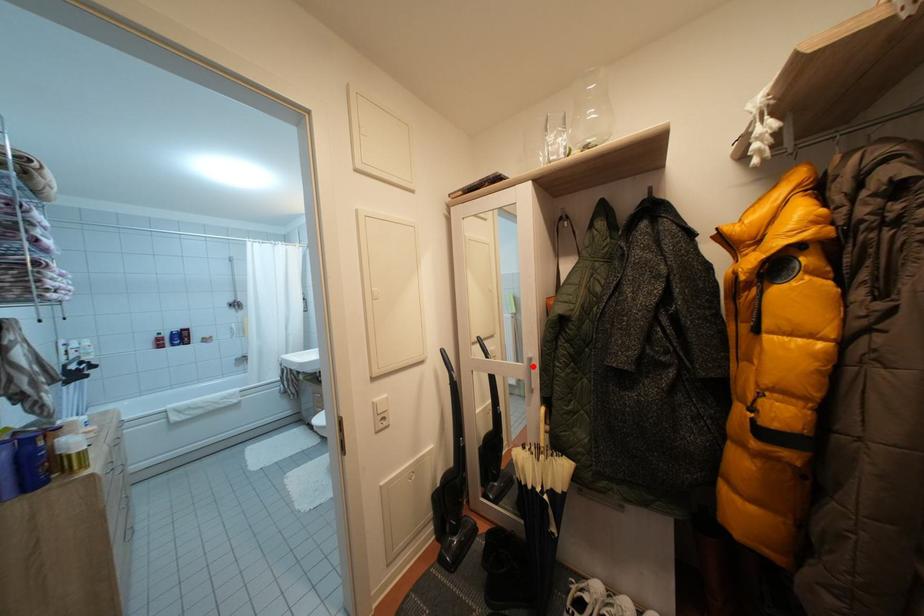
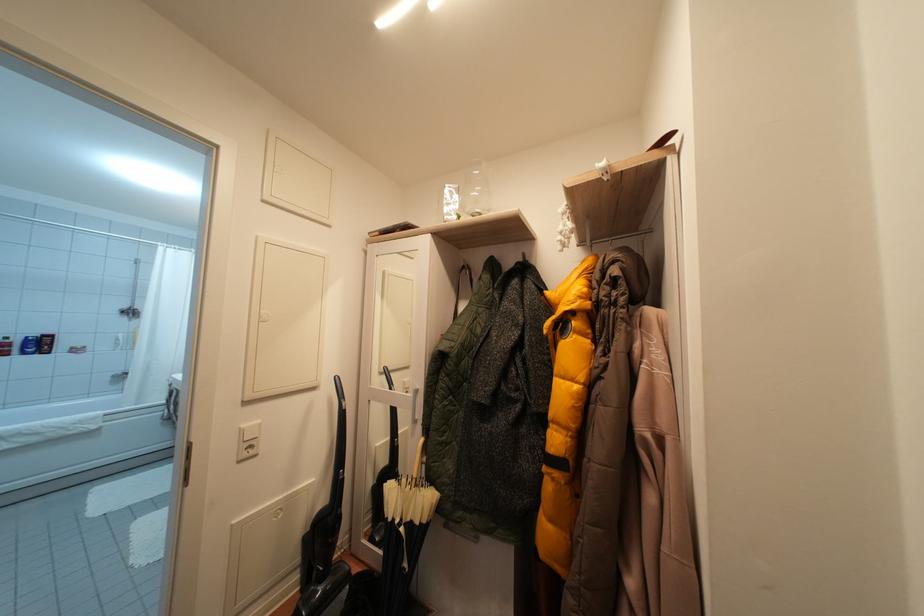
Question: I am providing you with two images of the same scene from different viewpoints. Given a red point in image1, look at the same physical point in image2. Is it:

Choices:
 (A) Closer to the viewpoint
 (B) Farther from the viewpoint

Answer: (B)